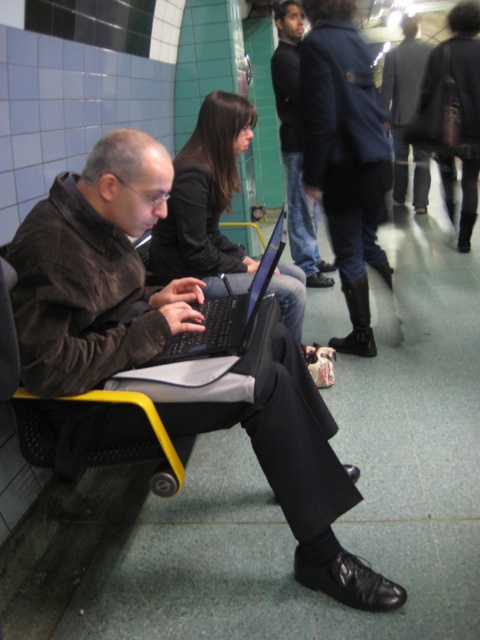
In the scene shown: You are standing at the point marked as point (240, 358) in a subway station. You want to buy a ticket from the vending machine located 2 meters away from your current position. Can you reach the vending machine without moving more than 1.5 meters from your current position?

The distance between you and the vending machine is 2 meters, which exceeds the 1.5 meters limit. Therefore, you cannot reach the vending machine without moving more than 1.5 meters from your current position.

You are a photographer trying to capture a candid shot of the man at the public transportation hub. You want to ensure that both the dark blue jeans at center and the black matte laptop at center are clearly visible in the frame. Given their sizes, which object should you focus on to ensure both are in focus?

The dark blue jeans at center is larger than the black matte laptop at center, so focusing on the larger object, dark blue jeans at center, will ensure both are in focus.

You are a photographer trying to capture a clear shot of the dark blue jeans at center and the black matte laptop at center. Which object should you adjust your camera focus on first if you want both to be in focus without moving the camera?

The dark blue jeans at center is wider than the black matte laptop at center, so you should focus on the wider object first to maximize depth of field coverage for both.